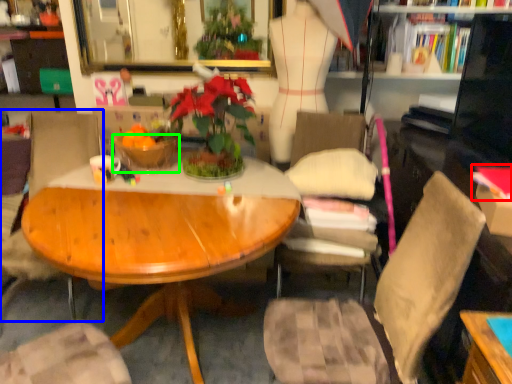
Question: Based on their relative distances, which object is nearer to book (highlighted by a red box)? Choose from chair (highlighted by a blue box) and bowl (highlighted by a green box).

Choices:
 (A) chair
 (B) bowl

Answer: (B)